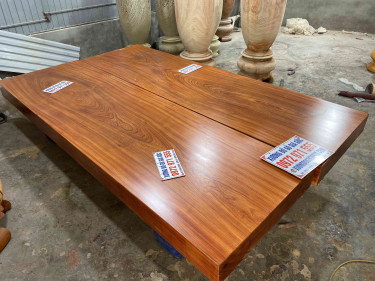
Find the location of a particular element. The width and height of the screenshot is (375, 281). light is located at coordinates (337, 235).